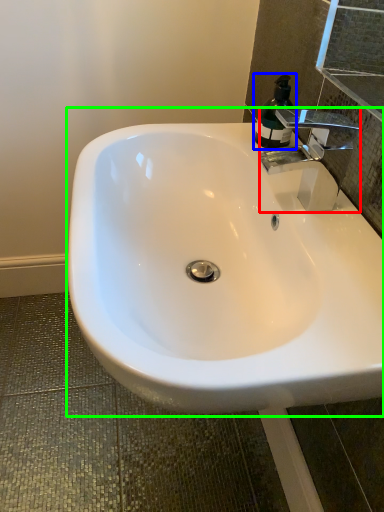
Question: Which object is the closest to the tap (highlighted by a red box)? Choose among these: soap dispenser (highlighted by a blue box) or sink (highlighted by a green box).

Choices:
 (A) soap dispenser
 (B) sink

Answer: (A)